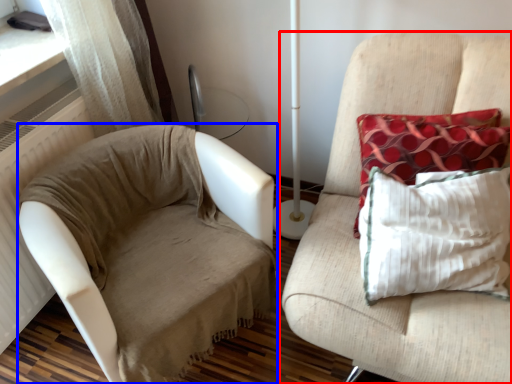
Question: Which object appears closest to the camera in this image, furniture (highlighted by a red box) or studio couch (highlighted by a blue box)?

Choices:
 (A) furniture
 (B) studio couch

Answer: (A)